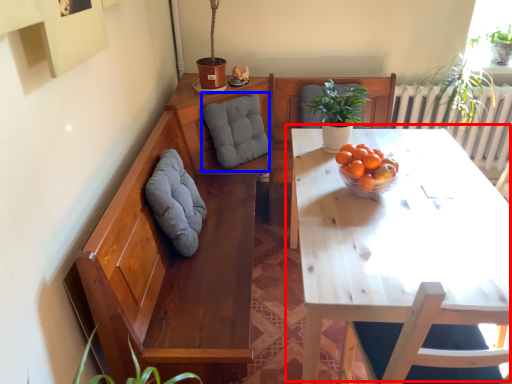
Question: Which object appears closest to the camera in this image, table (highlighted by a red box) or gray (highlighted by a blue box)?

Choices:
 (A) table
 (B) gray

Answer: (A)